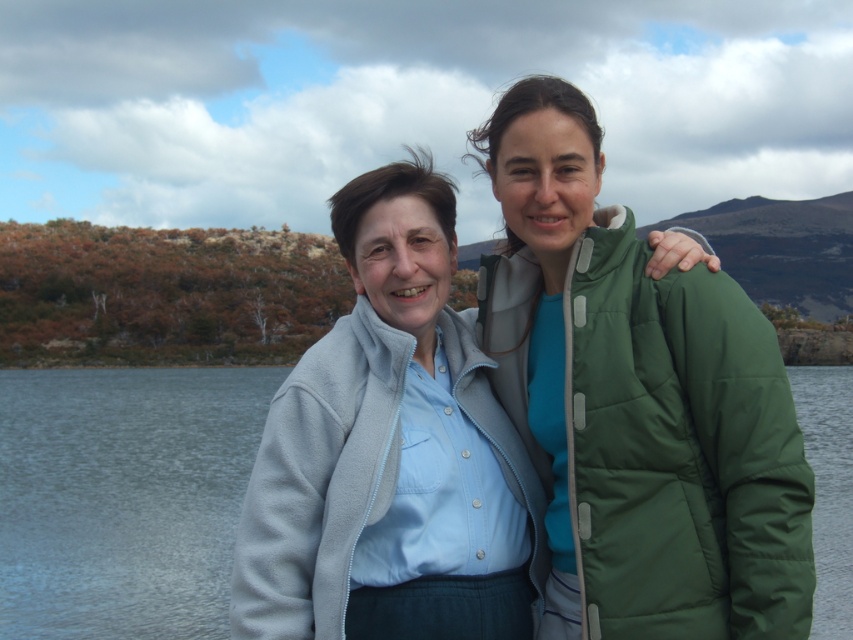
Between point (759, 628) and point (416, 496), which one is positioned in front?

Positioned in front is point (759, 628).

Based on the photo, does green puffy jacket at center have a larger size compared to light blue fleece jacket at center?

No.

Is point (662, 508) more distant than point (389, 179)?

No, (662, 508) is in front of (389, 179).

Image resolution: width=853 pixels, height=640 pixels. Find the location of `green puffy jacket at center`. green puffy jacket at center is located at coordinates (637, 403).

Which of these two, green puffy jacket at center or transparent water at center, stands shorter?

Standing shorter between the two is green puffy jacket at center.

Which is behind, point (761, 636) or point (84, 512)?

Positioned behind is point (84, 512).

Where is `green puffy jacket at center`? This screenshot has height=640, width=853. green puffy jacket at center is located at coordinates (637, 403).

Which is behind, point (265, 442) or point (833, 536)?

Point (833, 536)

Is point (276, 484) farther from viewer compared to point (103, 403)?

No, (276, 484) is closer to viewer.

This screenshot has width=853, height=640. I want to click on light blue fleece jacket at center, so click(x=387, y=452).

Where is `light blue fleece jacket at center`? light blue fleece jacket at center is located at coordinates (387, 452).